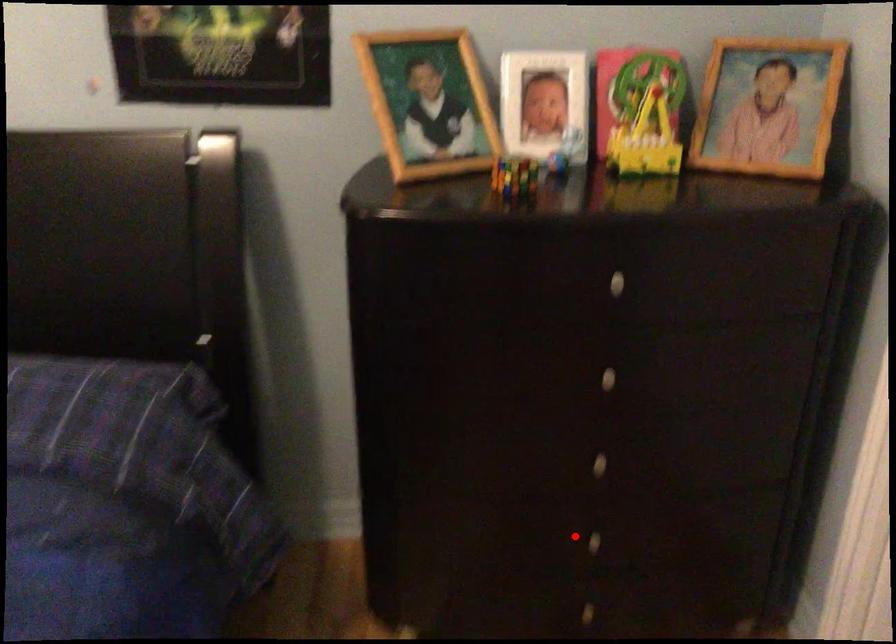
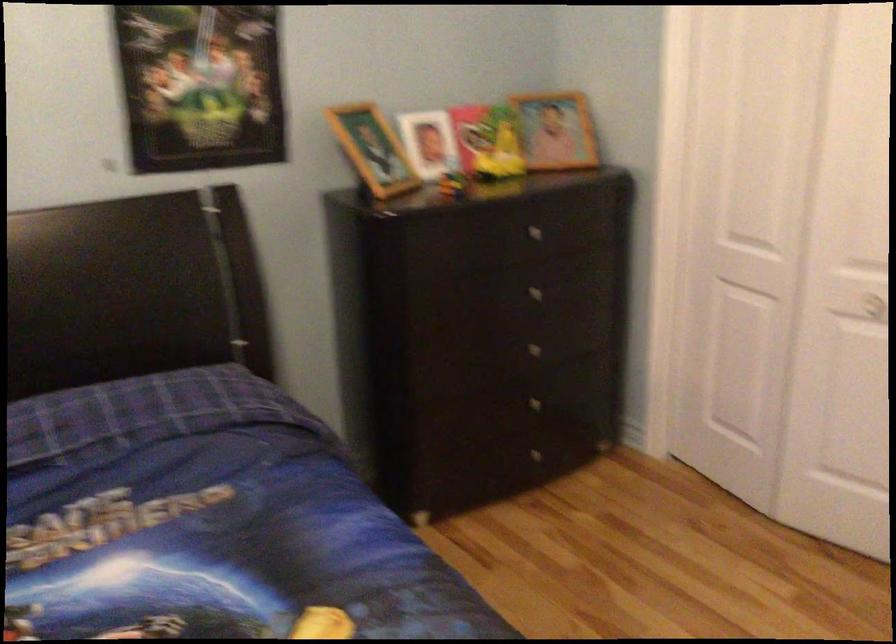
Question: I am providing you with two images of the same scene from different viewpoints. Image1 has a red point marked. In image2, the corresponding 3D location appears at what relative position? Reply with the corresponding letter.

Choices:
 (A) Closer
 (B) Farther

Answer: (B)